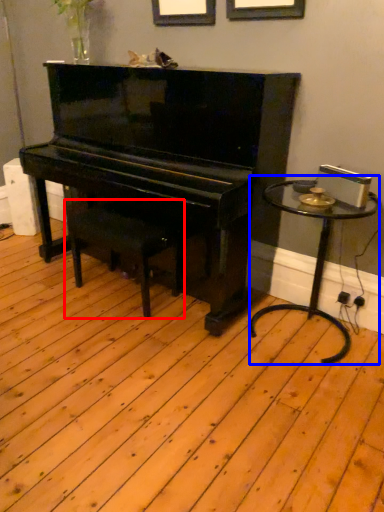
Question: Among these objects, which one is farthest to the camera, music stool (highlighted by a red box) or table (highlighted by a blue box)?

Choices:
 (A) music stool
 (B) table

Answer: (A)